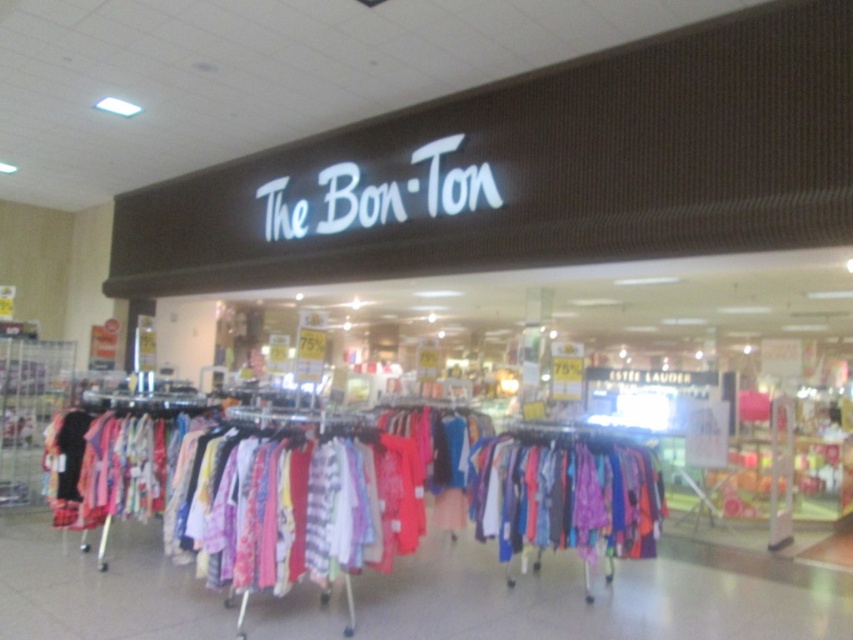
Is brightly colored fabric at center shorter than multicolored fabric dress at center?

No, brightly colored fabric at center is not shorter than multicolored fabric dress at center.

Which is in front, point (213, 486) or point (606, 520)?

Point (213, 486) is in front.

The image size is (853, 640). Identify the location of brightly colored fabric at center. (351, 490).